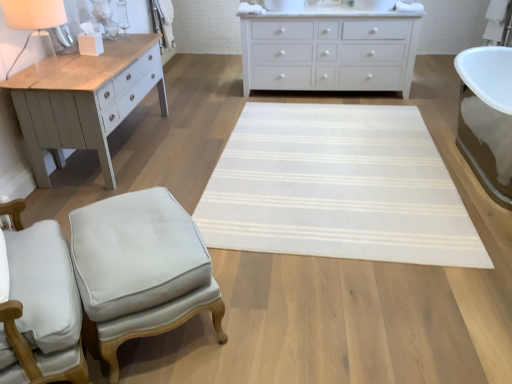
Question: Is white fabric chair at lower left to the left of white woven mat at center from the viewer's perspective?

Choices:
 (A) yes
 (B) no

Answer: (A)

Question: Is white fabric chair at lower left outside of white woven mat at center?

Choices:
 (A) no
 (B) yes

Answer: (B)

Question: From the image's perspective, is white fabric chair at lower left below white woven mat at center?

Choices:
 (A) yes
 (B) no

Answer: (A)

Question: Is white fabric chair at lower left closer to the viewer compared to white woven mat at center?

Choices:
 (A) yes
 (B) no

Answer: (A)

Question: Does white fabric chair at lower left come behind white woven mat at center?

Choices:
 (A) yes
 (B) no

Answer: (B)

Question: From the image's perspective, is light gray fabric stool at lower left above or below white matte table lamp at upper left?

Choices:
 (A) above
 (B) below

Answer: (B)

Question: In the image, is light gray fabric stool at lower left on the left side or the right side of white matte table lamp at upper left?

Choices:
 (A) right
 (B) left

Answer: (A)

Question: From a real-world perspective, relative to white matte table lamp at upper left, is light gray fabric stool at lower left vertically above or below?

Choices:
 (A) above
 (B) below

Answer: (B)

Question: Is light gray fabric stool at lower left taller or shorter than white matte table lamp at upper left?

Choices:
 (A) short
 (B) tall

Answer: (A)

Question: In the image, is white fabric chair at lower left on the left side or the right side of white woven mat at center?

Choices:
 (A) left
 (B) right

Answer: (A)

Question: From the image's perspective, is white fabric chair at lower left located above or below white woven mat at center?

Choices:
 (A) below
 (B) above

Answer: (A)

Question: Is white fabric chair at lower left wider or thinner than white woven mat at center?

Choices:
 (A) thin
 (B) wide

Answer: (A)

Question: Does point (69, 377) appear closer or farther from the camera than point (417, 180)?

Choices:
 (A) farther
 (B) closer

Answer: (B)

Question: Considering the relative positions of white matte chest of drawers at upper center and light gray fabric stool at lower left in the image provided, is white matte chest of drawers at upper center to the left or to the right of light gray fabric stool at lower left?

Choices:
 (A) right
 (B) left

Answer: (A)

Question: Relative to light gray fabric stool at lower left, is white matte chest of drawers at upper center in front or behind?

Choices:
 (A) behind
 (B) front

Answer: (A)